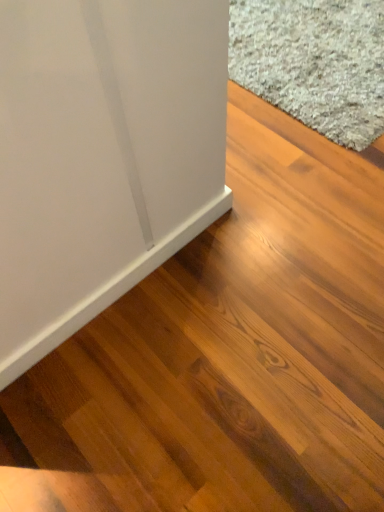
Describe the element at coordinates (102, 155) in the screenshot. I see `white matte baseboard at lower left` at that location.

The image size is (384, 512). Identify the location of white matte baseboard at lower left. (102, 155).

The image size is (384, 512). What do you see at coordinates (314, 62) in the screenshot? I see `gray shaggy carpet at upper right` at bounding box center [314, 62].

At what (x,y) coordinates should I click in order to perform the action: click on gray shaggy carpet at upper right. Please return your answer as a coordinate pair (x, y). This screenshot has width=384, height=512. Looking at the image, I should click on (314, 62).

Where is `white matte baseboard at lower left`? white matte baseboard at lower left is located at coordinates (102, 155).

In the scene shown: Between gray shaggy carpet at upper right and white matte baseboard at lower left, which one appears on the left side from the viewer's perspective?

white matte baseboard at lower left.

Which object is closer to the camera taking this photo, gray shaggy carpet at upper right or white matte baseboard at lower left?

white matte baseboard at lower left is in front.

Is point (361, 3) positioned behind point (166, 102)?

That is True.

From the image's perspective, is gray shaggy carpet at upper right positioned above or below white matte baseboard at lower left?

Clearly, from the image's perspective, gray shaggy carpet at upper right is above white matte baseboard at lower left.

From a real-world perspective, is gray shaggy carpet at upper right under white matte baseboard at lower left?

Yes.

Is gray shaggy carpet at upper right wider than white matte baseboard at lower left?

Yes, gray shaggy carpet at upper right is wider than white matte baseboard at lower left.

Does gray shaggy carpet at upper right have a greater height compared to white matte baseboard at lower left?

Incorrect, the height of gray shaggy carpet at upper right is not larger of that of white matte baseboard at lower left.

Considering the sizes of objects gray shaggy carpet at upper right and white matte baseboard at lower left in the image provided, who is bigger, gray shaggy carpet at upper right or white matte baseboard at lower left?

gray shaggy carpet at upper right.

Is gray shaggy carpet at upper right completely or partially outside of white matte baseboard at lower left?

Yes.

Is gray shaggy carpet at upper right touching white matte baseboard at lower left?

No, gray shaggy carpet at upper right is not next to white matte baseboard at lower left.

Is gray shaggy carpet at upper right positioned with its back to white matte baseboard at lower left?

gray shaggy carpet at upper right is not turned away from white matte baseboard at lower left.

Consider the image. What's the angular difference between gray shaggy carpet at upper right and white matte baseboard at lower left's facing directions?

The facing directions of gray shaggy carpet at upper right and white matte baseboard at lower left are 88.7 degrees apart.

The width and height of the screenshot is (384, 512). I want to click on doormat on the right of white matte baseboard at lower left, so click(x=314, y=62).

Based on the photo, considering the relative positions of white matte baseboard at lower left and gray shaggy carpet at upper right in the image provided, is white matte baseboard at lower left to the left of gray shaggy carpet at upper right from the viewer's perspective?

Correct, you'll find white matte baseboard at lower left to the left of gray shaggy carpet at upper right.

Which object is more forward, white matte baseboard at lower left or gray shaggy carpet at upper right?

white matte baseboard at lower left is closer to the camera.

Does point (56, 310) come in front of point (246, 2)?

Yes, it is.

From the image's perspective, is white matte baseboard at lower left located above gray shaggy carpet at upper right?

No.

From the picture: From a real-world perspective, is white matte baseboard at lower left located higher than gray shaggy carpet at upper right?

Yes, from a real-world perspective, white matte baseboard at lower left is over gray shaggy carpet at upper right

Considering the sizes of white matte baseboard at lower left and gray shaggy carpet at upper right in the image, is white matte baseboard at lower left wider or thinner than gray shaggy carpet at upper right?

white matte baseboard at lower left is thinner than gray shaggy carpet at upper right.

Is white matte baseboard at lower left taller or shorter than gray shaggy carpet at upper right?

Considering their sizes, white matte baseboard at lower left has more height than gray shaggy carpet at upper right.

In terms of size, does white matte baseboard at lower left appear bigger or smaller than gray shaggy carpet at upper right?

In the image, white matte baseboard at lower left appears to be smaller than gray shaggy carpet at upper right.

Does white matte baseboard at lower left contain gray shaggy carpet at upper right?

No, gray shaggy carpet at upper right is not inside white matte baseboard at lower left.

Is white matte baseboard at lower left next to gray shaggy carpet at upper right and touching it?

No, white matte baseboard at lower left is not making contact with gray shaggy carpet at upper right.

Is white matte baseboard at lower left facing away from gray shaggy carpet at upper right?

No, gray shaggy carpet at upper right is not at the back of white matte baseboard at lower left.

What's the angular difference between white matte baseboard at lower left and gray shaggy carpet at upper right's facing directions?

The angle between the facing direction of white matte baseboard at lower left and the facing direction of gray shaggy carpet at upper right is 88.7 degrees.

Identify the location of furniture that appears below the gray shaggy carpet at upper right (from the image's perspective). 102,155.

I want to click on doormat that appears on the right of white matte baseboard at lower left, so click(x=314, y=62).

Locate an element on the screen. Image resolution: width=384 pixels, height=512 pixels. furniture below the gray shaggy carpet at upper right (from the image's perspective) is located at coordinates (102, 155).